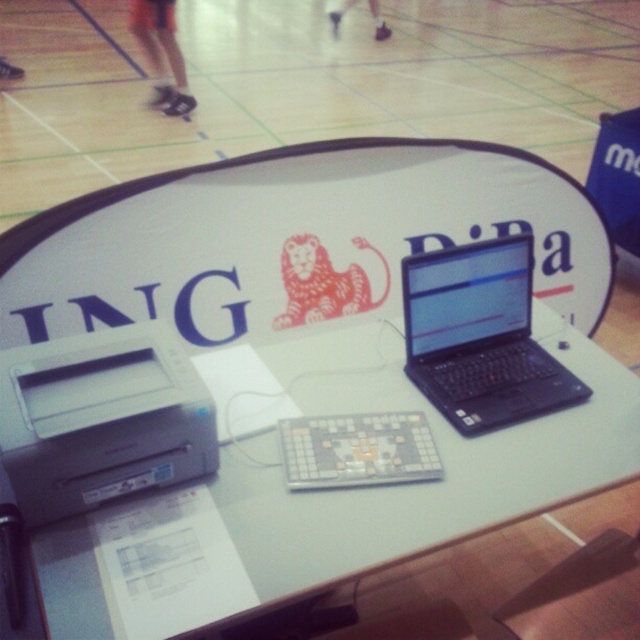
Question: Is black matte laptop at center positioned before white plastic register at center?

Choices:
 (A) yes
 (B) no

Answer: (B)

Question: Estimate the real-world distances between objects in this image. Which object is farther from the white plastic register at center?

Choices:
 (A) black matte laptop at center
 (B) gray plastic printer at lower left

Answer: (B)

Question: Is gray plastic printer at lower left bigger than white plastic register at center?

Choices:
 (A) no
 (B) yes

Answer: (B)

Question: Can you confirm if gray plastic printer at lower left is thinner than black matte laptop at center?

Choices:
 (A) yes
 (B) no

Answer: (A)

Question: Which is farther from the white plastic register at center?

Choices:
 (A) black matte laptop at center
 (B) white glossy table at center

Answer: (A)

Question: Based on their relative distances, which object is nearer to the gray plastic printer at lower left?

Choices:
 (A) black matte laptop at center
 (B) white plastic register at center
 (C) white glossy table at center

Answer: (C)